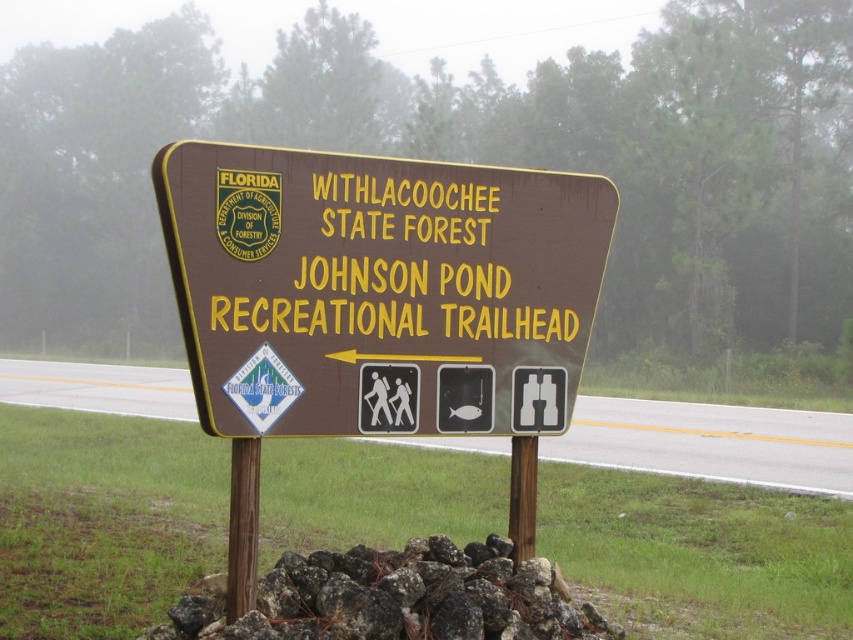
Based on the photo, you are a hiker trying to read the signboard at the Johnson Pond Recreational Trailhead. From your vantage point, which object is closer to you? The brown wooden signpost at center or the dark gray rock at center?

The brown wooden signpost at center is closer to you because the dark gray rock at center is behind it.

You are standing in front of the brown wooden sign at center and the brown wooden signpost at center. Which object is closer to you?

The brown wooden sign at center is closer to you because it is in front of the brown wooden signpost at center.

You are standing in front of the brown wooden sign at center and dark gray rock at center. Which object is positioned to the left?

The dark gray rock at center is positioned to the left of the brown wooden sign at center.